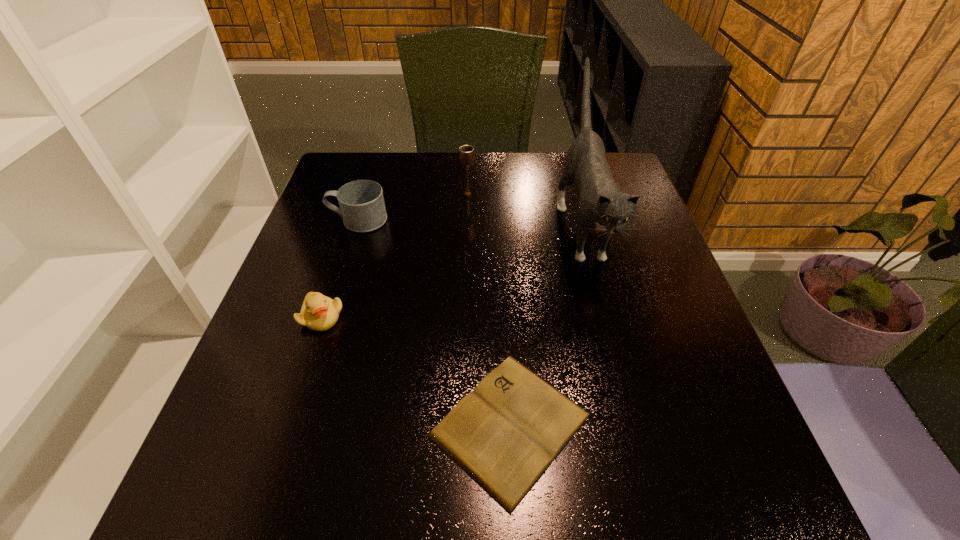
Identify the location of vacant space located 0.060m on the beak of the second shortest object. (307, 359).

Where is `free space located on the back of the nearest object`? This screenshot has width=960, height=540. free space located on the back of the nearest object is located at coordinates (502, 270).

Identify the location of cat that is at the far edge. The width and height of the screenshot is (960, 540). (602, 207).

Locate an element on the screen. chalice at the far edge is located at coordinates (466, 152).

This screenshot has height=540, width=960. I want to click on object positioned at the near edge, so click(504, 434).

I want to click on mug that is at the left edge, so click(362, 208).

What are the coordinates of `duckling situated at the left edge` in the screenshot? It's located at (318, 312).

The height and width of the screenshot is (540, 960). In order to click on object located in the right edge section of the desktop in this screenshot , I will do `click(602, 207)`.

At what (x,y) coordinates should I click in order to perform the action: click on object that is at the far right corner. Please return your answer as a coordinate pair (x, y). This screenshot has width=960, height=540. Looking at the image, I should click on (602, 207).

I want to click on vacant space at the far edge of the desktop, so click(551, 160).